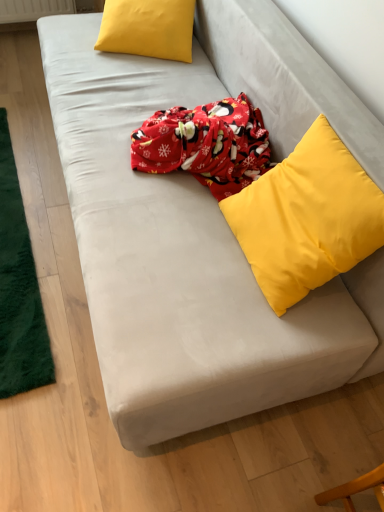
Where is `matte yellow pillow at upper left, which appears as the first pillow when viewed from the top`? matte yellow pillow at upper left, which appears as the first pillow when viewed from the top is located at coordinates (148, 28).

What are the coordinates of `matte yellow pillow at upper left, the 1th pillow when ordered from left to right` in the screenshot? It's located at (148, 28).

Can you confirm if yellow matte pillow at upper right, the first pillow from the front, is thinner than green plush mat at left?

Correct, the width of yellow matte pillow at upper right, the first pillow from the front, is less than that of green plush mat at left.

Which is closer, (349,184) or (36,378)?

The point (349,184) is closer to the camera.

From the image's perspective, is yellow matte pillow at upper right, the 2th pillow from the top, on green plush mat at left?

Actually, yellow matte pillow at upper right, the 2th pillow from the top, appears below green plush mat at left in the image.

Is yellow matte pillow at upper right, the 2th pillow from the top, bigger than green plush mat at left?

Yes.

From a real-world perspective, is yellow matte pillow at upper right, the 2th pillow from the top, above or below matte yellow pillow at upper left, the 1th pillow when ordered from left to right?

yellow matte pillow at upper right, the 2th pillow from the top, is situated higher than matte yellow pillow at upper left, the 1th pillow when ordered from left to right, in the real world.

Considering the sizes of objects yellow matte pillow at upper right, the second pillow viewed from the back, and matte yellow pillow at upper left, the 1th pillow from the back, in the image provided, who is wider, yellow matte pillow at upper right, the second pillow viewed from the back, or matte yellow pillow at upper left, the 1th pillow from the back,?

matte yellow pillow at upper left, the 1th pillow from the back.

Which is nearer, (339, 253) or (125, 38)?

Point (339, 253) is positioned closer to the camera compared to point (125, 38).

Which of these two, yellow matte pillow at upper right, which ranks as the first pillow in right-to-left order, or matte yellow pillow at upper left, which is counted as the 2th pillow, starting from the bottom, is smaller?

matte yellow pillow at upper left, which is counted as the 2th pillow, starting from the bottom, is smaller.

Is green plush mat at left oriented towards yellow matte pillow at upper right, the second pillow viewed from the back?

No, green plush mat at left is not turned towards yellow matte pillow at upper right, the second pillow viewed from the back.

Between green plush mat at left and yellow matte pillow at upper right, the 2th pillow from the top, which one has smaller width?

With smaller width is yellow matte pillow at upper right, the 2th pillow from the top.

Does point (3, 230) come behind point (308, 139)?

Yes, point (3, 230) is farther from viewer.

Based on their positions, is matte yellow pillow at upper left, the 1th pillow when ordered from left to right, located to the left or right of yellow matte pillow at upper right, which ranks as the first pillow in right-to-left order?

In the image, matte yellow pillow at upper left, the 1th pillow when ordered from left to right, appears on the left side of yellow matte pillow at upper right, which ranks as the first pillow in right-to-left order.

Is matte yellow pillow at upper left, the 1th pillow when ordered from left to right, further to the viewer compared to yellow matte pillow at upper right, the 2th pillow from the top?

Yes.

Is matte yellow pillow at upper left, which is counted as the 2th pillow, starting from the bottom, turned away from yellow matte pillow at upper right, which appears as the second pillow when viewed from the left?

No, matte yellow pillow at upper left, which is counted as the 2th pillow, starting from the bottom, is not facing away from yellow matte pillow at upper right, which appears as the second pillow when viewed from the left.

Is green plush mat at left positioned with its back to matte yellow pillow at upper left, which appears as the first pillow when viewed from the top?

That's not correct — green plush mat at left is not looking away from matte yellow pillow at upper left, which appears as the first pillow when viewed from the top.

Is green plush mat at left thinner than matte yellow pillow at upper left, the 1th pillow when ordered from left to right?

In fact, green plush mat at left might be wider than matte yellow pillow at upper left, the 1th pillow when ordered from left to right.

Does green plush mat at left have a greater height compared to matte yellow pillow at upper left, the 1th pillow from the back?

Incorrect, the height of green plush mat at left is not larger of that of matte yellow pillow at upper left, the 1th pillow from the back.

Is green plush mat at left not within matte yellow pillow at upper left, which is counted as the 2th pillow, starting from the bottom?

green plush mat at left is positioned outside matte yellow pillow at upper left, which is counted as the 2th pillow, starting from the bottom.

Which is behind, matte yellow pillow at upper left, the 1th pillow from the back, or green plush mat at left?

matte yellow pillow at upper left, the 1th pillow from the back, is behind.

From the image's perspective, which is below, matte yellow pillow at upper left, the 1th pillow when ordered from left to right, or green plush mat at left?

green plush mat at left is shown below in the image.

Does matte yellow pillow at upper left, which ranks as the second pillow in front-to-back order, have a larger size compared to green plush mat at left?

Yes, matte yellow pillow at upper left, which ranks as the second pillow in front-to-back order, is bigger than green plush mat at left.

Locate an element on the screen. the 1st pillow counting from the right side of the green plush mat at left is located at coordinates (148, 28).

Identify the location of pillow below the green plush mat at left (from the image's perspective). pyautogui.click(x=307, y=218).

The width and height of the screenshot is (384, 512). Find the location of `pillow above the matte yellow pillow at upper left, which appears as the first pillow when viewed from the top (from a real-world perspective)`. pillow above the matte yellow pillow at upper left, which appears as the first pillow when viewed from the top (from a real-world perspective) is located at coordinates (x=307, y=218).

Estimate the real-world distances between objects in this image. Which object is closer to green plush mat at left, matte yellow pillow at upper left, which appears as the first pillow when viewed from the top, or yellow matte pillow at upper right, the first pillow in the bottom-to-top sequence?

matte yellow pillow at upper left, which appears as the first pillow when viewed from the top, is closer to green plush mat at left.

Considering their positions, is matte yellow pillow at upper left, the 1th pillow from the back, positioned closer to yellow matte pillow at upper right, the first pillow in the bottom-to-top sequence, than green plush mat at left?

The object closer to yellow matte pillow at upper right, the first pillow in the bottom-to-top sequence, is green plush mat at left.

Looking at this image, which object lies nearer to the anchor point matte yellow pillow at upper left, which is counted as the 2th pillow, starting from the bottom, green plush mat at left or yellow matte pillow at upper right, the 2th pillow from the top?

Among the two, green plush mat at left is located nearer to matte yellow pillow at upper left, which is counted as the 2th pillow, starting from the bottom.

Based on their spatial positions, is yellow matte pillow at upper right, the first pillow from the front, or green plush mat at left closer to matte yellow pillow at upper left, marked as the 2th pillow in a right-to-left arrangement?

Based on the image, green plush mat at left appears to be nearer to matte yellow pillow at upper left, marked as the 2th pillow in a right-to-left arrangement.

From the image, which object appears to be nearer to green plush mat at left, yellow matte pillow at upper right, the 2th pillow from the top, or matte yellow pillow at upper left, which appears as the first pillow when viewed from the top?

matte yellow pillow at upper left, which appears as the first pillow when viewed from the top, is positioned closer to the anchor green plush mat at left.

Estimate the real-world distances between objects in this image. Which object is further from yellow matte pillow at upper right, the 2th pillow from the top, green plush mat at left or matte yellow pillow at upper left, the 1th pillow when ordered from left to right?

The object further to yellow matte pillow at upper right, the 2th pillow from the top, is matte yellow pillow at upper left, the 1th pillow when ordered from left to right.

What are the coordinates of `mat between matte yellow pillow at upper left, which ranks as the second pillow in front-to-back order, and yellow matte pillow at upper right, the first pillow in the bottom-to-top sequence, from top to bottom` in the screenshot? It's located at (19, 289).